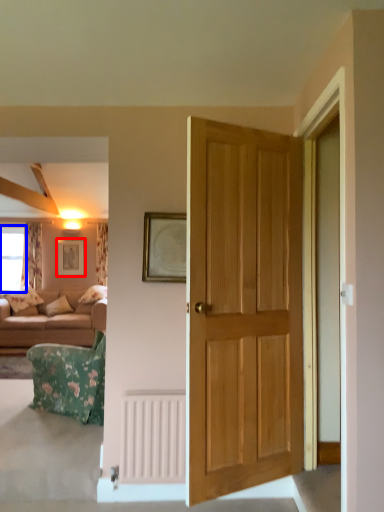
Question: Which of the following is the closest to the observer, picture frame (highlighted by a red box) or window (highlighted by a blue box)?

Choices:
 (A) picture frame
 (B) window

Answer: (A)